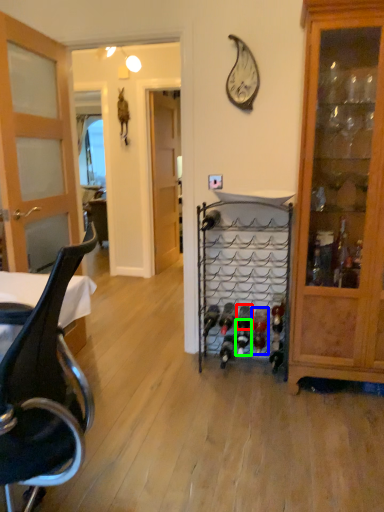
Question: Which object is the farthest from wine bottle (highlighted by a red box)? Choose among these: wine bottle (highlighted by a blue box) or wine bottle (highlighted by a green box).

Choices:
 (A) wine bottle
 (B) wine bottle

Answer: (A)